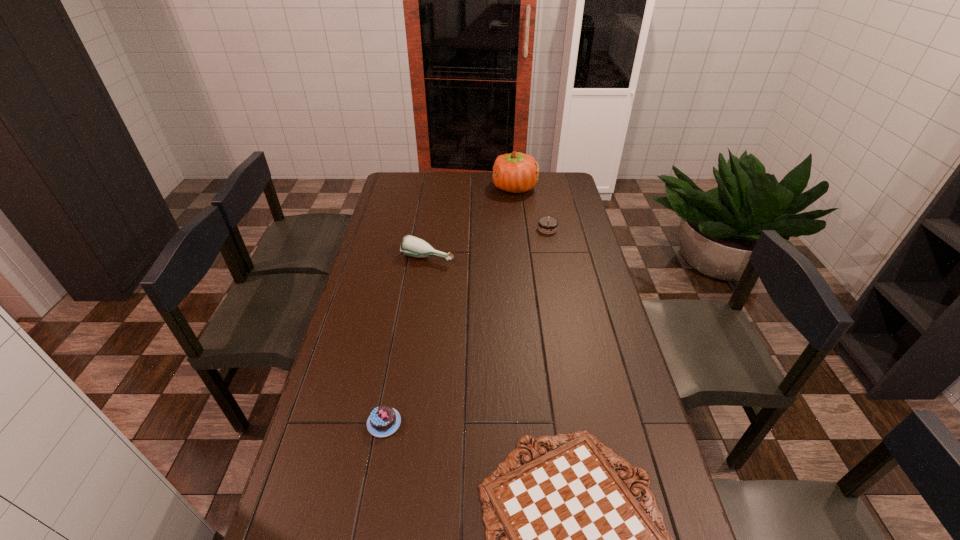
Identify the location of vacant space that satisfies the following two spatial constraints: 1. on the back side of the third tallest object; 2. on the side of the farthest object with the cute face. (540, 188).

Identify the location of vacant position in the image that satisfies the following two spatial constraints: 1. on the back side of the fourth nearest object; 2. on the right side of the left chocolate cake. The height and width of the screenshot is (540, 960). (420, 229).

The height and width of the screenshot is (540, 960). Identify the location of free point that satisfies the following two spatial constraints: 1. on the side of the fourth nearest object with the cute face; 2. on the left side of the pumpkin. (519, 229).

In order to click on free spot that satisfies the following two spatial constraints: 1. on the back side of the bottle; 2. on the right side of the taller chocolate cake in this screenshot , I will do `click(432, 229)`.